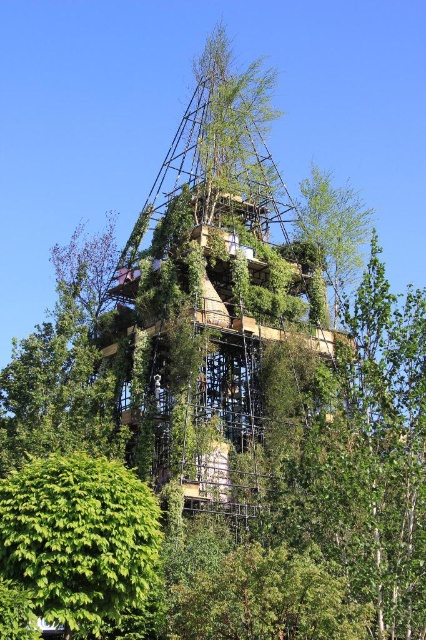
Does green leafy bush at lower left have a lesser height compared to green leafy tree at lower center?

Incorrect, green leafy bush at lower left's height does not fall short of green leafy tree at lower center's.

Is point (63, 579) in front of point (270, 637)?

Yes, it is in front of point (270, 637).

Who is more forward, (126, 552) or (284, 605)?

Positioned in front is point (126, 552).

The image size is (426, 640). Identify the location of green leafy bush at lower left. (78, 538).